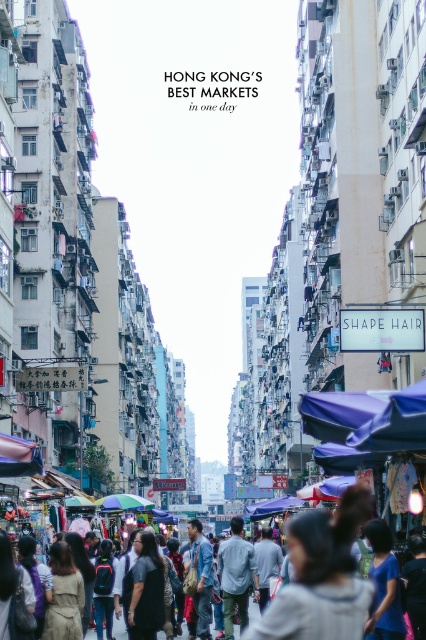
Is point (210, 593) farther from camera compared to point (3, 465)?

Yes, it is.

Which is behind, point (192, 532) or point (28, 472)?

The point (192, 532) is behind.

Measure the distance between blue denim jacket at center and camera.

The distance of blue denim jacket at center from camera is 293.93 feet.

Where is `blue denim jacket at center`? blue denim jacket at center is located at coordinates (199, 577).

Does blue denim jacket at center have a smaller size compared to blue fabric canopy at center?

Indeed, blue denim jacket at center has a smaller size compared to blue fabric canopy at center.

Between blue denim jacket at center and blue fabric canopy at center, which one appears on the right side from the viewer's perspective?

blue denim jacket at center is more to the right.

Is point (206, 541) positioned after point (106, 497)?

No, (206, 541) is closer to viewer.

Where is `blue denim jacket at center`? The image size is (426, 640). blue denim jacket at center is located at coordinates (199, 577).

Can you confirm if purple fabric canopy at center is positioned to the right of blue fabric canopy at center?

Indeed, purple fabric canopy at center is positioned on the right side of blue fabric canopy at center.

Which of these two, purple fabric canopy at center or blue fabric canopy at center, stands taller?

purple fabric canopy at center

The width and height of the screenshot is (426, 640). What do you see at coordinates (271, 508) in the screenshot?
I see `purple fabric canopy at center` at bounding box center [271, 508].

At what (x,y) coordinates should I click in order to perform the action: click on purple fabric canopy at center. Please return your answer as a coordinate pair (x, y). The height and width of the screenshot is (640, 426). Looking at the image, I should click on (271, 508).